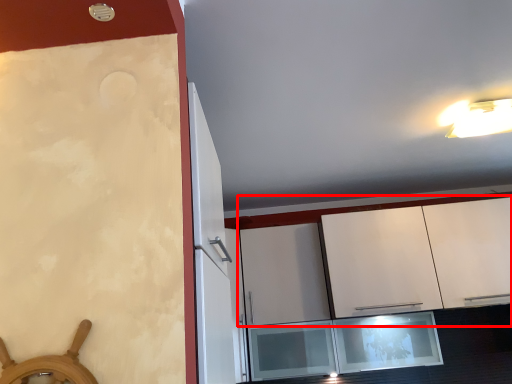
Question: From the image, what is the correct spatial relationship of cabinetry (annotated by the red box) in relation to light fixture?

Choices:
 (A) right
 (B) left

Answer: (B)